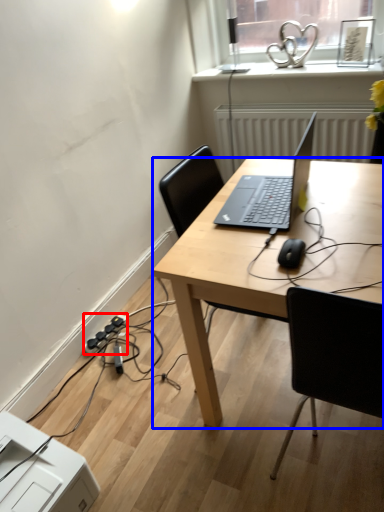
Question: Among these objects, which one is nearest to the camera, extension cord (highlighted by a red box) or desk (highlighted by a blue box)?

Choices:
 (A) extension cord
 (B) desk

Answer: (B)